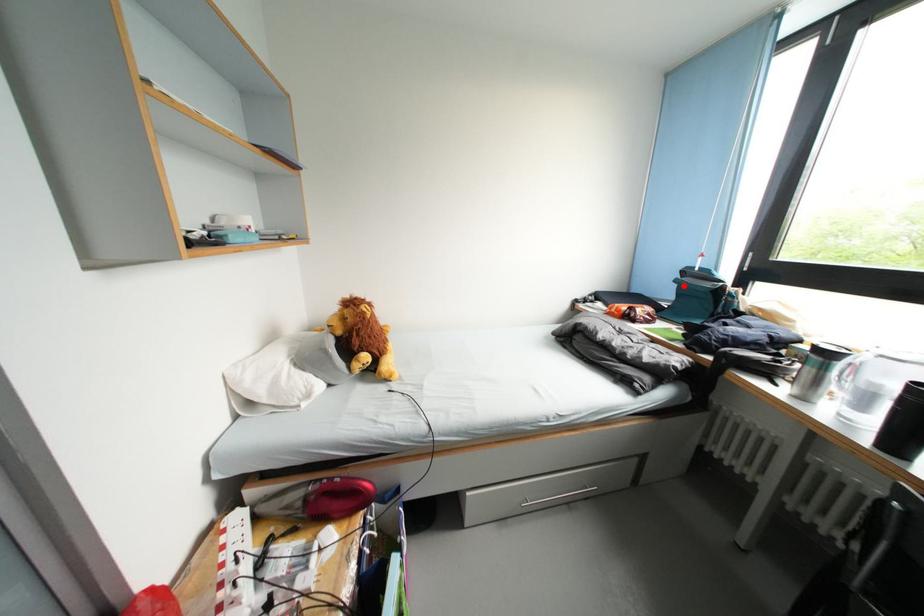
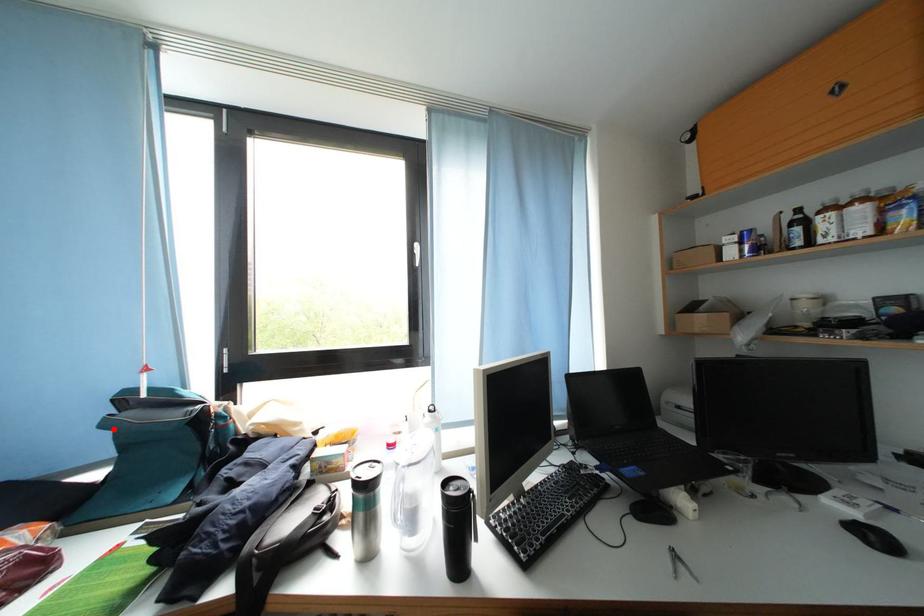
I am providing you with two images of the same scene from different viewpoints. A red point is marked on the first image and another point is marked on the second image. Is the red point in image1 aligned with the point shown in image2?

Yes